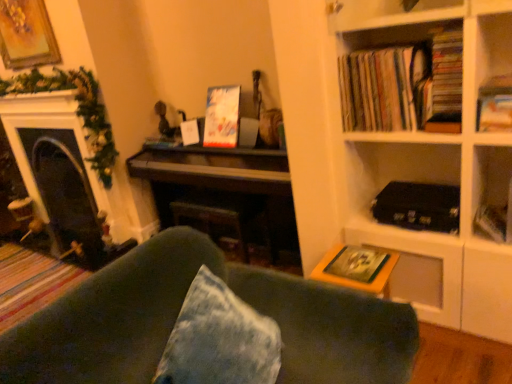
What is the approximate width of hardcover book at upper right, the 2th paperback book viewed from the top?

hardcover book at upper right, the 2th paperback book viewed from the top, is 11.61 centimeters in width.

This screenshot has width=512, height=384. Find the location of `matte paper at center, which is counted as the 3th paperback book, starting from the bottom`. matte paper at center, which is counted as the 3th paperback book, starting from the bottom is located at coordinates click(222, 117).

This screenshot has height=384, width=512. Find the location of `hardcover book at upper right, arranged as the 2th book when viewed from the left`. hardcover book at upper right, arranged as the 2th book when viewed from the left is located at coordinates (494, 113).

The image size is (512, 384). What do you see at coordinates (404, 85) in the screenshot? I see `matte cardboard books at upper right, which appears as the 1th book when viewed from the left` at bounding box center [404, 85].

The height and width of the screenshot is (384, 512). What do you see at coordinates (357, 264) in the screenshot? I see `yellow matte paperback book at lower right, positioned as the 3th paperback book in top-to-bottom order` at bounding box center [357, 264].

Where is `hardcover book at upper right, the 2th paperback book when ordered from bottom to top`? hardcover book at upper right, the 2th paperback book when ordered from bottom to top is located at coordinates (492, 222).

What's the angular difference between wooden bookcase at right and hardcover book at upper right, arranged as the 2th book when viewed from the left,'s facing directions?

They differ by 0.733 degrees in their facing directions.

Is wooden bookcase at right far from hardcover book at upper right, arranged as the 2th book when viewed from the left?

No, there isn't a large distance between wooden bookcase at right and hardcover book at upper right, arranged as the 2th book when viewed from the left.

Which is correct: wooden bookcase at right is inside hardcover book at upper right, arranged as the 2th book when viewed from the left, or outside of it?

wooden bookcase at right is not inside hardcover book at upper right, arranged as the 2th book when viewed from the left, it's outside.

Would you say dark wood piano at center is to the left or to the right of matte paper at center, which ranks as the third paperback book in right-to-left order, in the picture?

dark wood piano at center is positioned on matte paper at center, which ranks as the third paperback book in right-to-left order,'s left side.

Which is in front, point (182, 213) or point (238, 118)?

Point (238, 118)

How different are the orientations of dark wood piano at center and matte paper at center, acting as the 1th paperback book starting from the back, in degrees?

The facing directions of dark wood piano at center and matte paper at center, acting as the 1th paperback book starting from the back, are 0.35 degrees apart.

Is dark wood piano at center placed right next to matte paper at center, acting as the 1th paperback book starting from the back?

dark wood piano at center is not next to matte paper at center, acting as the 1th paperback book starting from the back, and they're not touching.

From the image's perspective, is matte paper at center, which ranks as the third paperback book in right-to-left order, beneath green fabric couch at lower center?

No, from the image's perspective, matte paper at center, which ranks as the third paperback book in right-to-left order, is not beneath green fabric couch at lower center.

From a real-world perspective, is matte paper at center, which is the 1th paperback book from top to bottom, physically above green fabric couch at lower center?

Answer: Yes, from a real-world perspective, matte paper at center, which is the 1th paperback book from top to bottom, is above green fabric couch at lower center.

How much distance is there between matte paper at center, which is counted as the 3th paperback book, starting from the bottom, and green fabric couch at lower center?

matte paper at center, which is counted as the 3th paperback book, starting from the bottom, and green fabric couch at lower center are 1.35 meters apart.

Are hardcover book at upper right, acting as the second paperback book starting from the back, and matte cardboard books at upper right, which appears as the 1th book when viewed from the left, far apart?

hardcover book at upper right, acting as the second paperback book starting from the back, is near matte cardboard books at upper right, which appears as the 1th book when viewed from the left, not far away.

Which is behind, hardcover book at upper right, which ranks as the third paperback book in left-to-right order, or matte cardboard books at upper right, which appears as the second book when viewed from the right?

hardcover book at upper right, which ranks as the third paperback book in left-to-right order.

From the image's perspective, is hardcover book at upper right, the 2th paperback book viewed from the top, beneath matte cardboard books at upper right, which appears as the 1th book when viewed from the left?

Result: Yes, from the image's perspective, hardcover book at upper right, the 2th paperback book viewed from the top, is below matte cardboard books at upper right, which appears as the 1th book when viewed from the left.

Is hardcover book at upper right, the 2th paperback book viewed from the top, wider than matte cardboard books at upper right, which appears as the 1th book when viewed from the left?

Incorrect, the width of hardcover book at upper right, the 2th paperback book viewed from the top, does not surpass that of matte cardboard books at upper right, which appears as the 1th book when viewed from the left.

Based on their sizes in the image, would you say hardcover book at upper right, arranged as the 2th book when viewed from the left, is bigger or smaller than green fabric couch at lower center?

Clearly, hardcover book at upper right, arranged as the 2th book when viewed from the left, is smaller in size than green fabric couch at lower center.

From a real-world perspective, is hardcover book at upper right, which appears as the first book when viewed from the right, located beneath green fabric couch at lower center?

Actually, hardcover book at upper right, which appears as the first book when viewed from the right, is physically above green fabric couch at lower center in the real world.

In the image, is hardcover book at upper right, arranged as the 2th book when viewed from the left, positioned in front of or behind green fabric couch at lower center?

Visually, hardcover book at upper right, arranged as the 2th book when viewed from the left, is located behind green fabric couch at lower center.

Considering the sizes of objects hardcover book at upper right, arranged as the 2th book when viewed from the left, and green fabric couch at lower center in the image provided, who is wider, hardcover book at upper right, arranged as the 2th book when viewed from the left, or green fabric couch at lower center?

Wider between the two is green fabric couch at lower center.

Would you say hardcover book at upper right, the 2th paperback book viewed from the top, is outside matte paper at center, acting as the 1th paperback book starting from the back?

Indeed, hardcover book at upper right, the 2th paperback book viewed from the top, is completely outside matte paper at center, acting as the 1th paperback book starting from the back.

From a real-world perspective, which is physically below, hardcover book at upper right, which is the 2th paperback book in front-to-back order, or matte paper at center, which ranks as the third paperback book in right-to-left order?

hardcover book at upper right, which is the 2th paperback book in front-to-back order, from a real-world perspective.

Image resolution: width=512 pixels, height=384 pixels. I want to click on paperback book lying behind the hardcover book at upper right, which is the 2th paperback book in front-to-back order, so click(222, 117).

Looking at their sizes, would you say hardcover book at upper right, the 2th paperback book viewed from the top, is wider or thinner than matte paper at center, which ranks as the third paperback book in right-to-left order?

Clearly, hardcover book at upper right, the 2th paperback book viewed from the top, has less width compared to matte paper at center, which ranks as the third paperback book in right-to-left order.

Would you say matte paper at center, which ranks as the third paperback book in right-to-left order, is inside or outside hardcover book at upper right, which is the 2th paperback book in front-to-back order?

matte paper at center, which ranks as the third paperback book in right-to-left order, is located beyond the bounds of hardcover book at upper right, which is the 2th paperback book in front-to-back order.

Does matte paper at center, which is counted as the 3th paperback book, starting from the bottom, have a greater width compared to hardcover book at upper right, which ranks as the third paperback book in left-to-right order?

Yes.

Can you confirm if matte paper at center, which is counted as the 3th paperback book, starting from the bottom, is positioned to the left of hardcover book at upper right, the 2th paperback book when ordered from bottom to top?

Correct, you'll find matte paper at center, which is counted as the 3th paperback book, starting from the bottom, to the left of hardcover book at upper right, the 2th paperback book when ordered from bottom to top.

Does matte paper at center, which ranks as the third paperback book in right-to-left order, have a lesser height compared to hardcover book at upper right, the 2th paperback book when ordered from bottom to top?

No, matte paper at center, which ranks as the third paperback book in right-to-left order, is not shorter than hardcover book at upper right, the 2th paperback book when ordered from bottom to top.

You are a GUI agent. You are given a task and a screenshot of the screen. Output one action in this format:
    pyautogui.click(x=<x>, y=<y>)
    Task: Click on the bookcase on the left of the hardcover book at upper right, arranged as the 2th book when viewed from the left
    
    Given the screenshot: What is the action you would take?
    pyautogui.click(x=438, y=159)

The image size is (512, 384). I want to click on piano in front of the matte paper at center, acting as the 1th paperback book starting from the back, so click(x=222, y=193).

Looking at this image, which object lies nearer to the anchor point hardcover book at upper right, which is counted as the 1th paperback book, starting from the right, dark wood piano at center or matte paper at center, the 1th paperback book viewed from the left?

Based on the image, dark wood piano at center appears to be nearer to hardcover book at upper right, which is counted as the 1th paperback book, starting from the right.

Considering their positions, is yellow matte paperback book at lower right, the 1th paperback book positioned from the bottom, positioned further to matte paper at center, which ranks as the third paperback book in right-to-left order, than green fabric couch at lower center?

green fabric couch at lower center lies further to matte paper at center, which ranks as the third paperback book in right-to-left order, than the other object.

Based on their spatial positions, is yellow matte paperback book at lower right, marked as the first paperback book in a front-to-back arrangement, or matte cardboard books at upper right, which appears as the 1th book when viewed from the left, further from hardcover book at upper right, the 2th paperback book when ordered from bottom to top?

Based on the image, matte cardboard books at upper right, which appears as the 1th book when viewed from the left, appears to be further to hardcover book at upper right, the 2th paperback book when ordered from bottom to top.

Based on their spatial positions, is wooden bookcase at right or matte cardboard books at upper right, which appears as the second book when viewed from the right, closer to hardcover book at upper right, which ranks as the third paperback book in left-to-right order?

wooden bookcase at right is positioned closer to the anchor hardcover book at upper right, which ranks as the third paperback book in left-to-right order.

Estimate the real-world distances between objects in this image. Which object is further from dark wood piano at center, hardcover book at upper right, which appears as the first book when viewed from the right, or wooden bookcase at right?

hardcover book at upper right, which appears as the first book when viewed from the right, lies further to dark wood piano at center than the other object.

Based on the photo, when comparing their distances from hardcover book at upper right, which is the 2th paperback book in front-to-back order, does matte paper at center, which appears as the third paperback book when viewed from the front, or dark wood piano at center seem closer?

dark wood piano at center is positioned closer to the anchor hardcover book at upper right, which is the 2th paperback book in front-to-back order.

Considering their positions, is matte paper at center, which is the 1th paperback book from top to bottom, positioned further to wooden bookcase at right than hardcover book at upper right, which appears as the first book when viewed from the right?

The object further to wooden bookcase at right is matte paper at center, which is the 1th paperback book from top to bottom.

From the image, which object appears to be farther from gold-framed painting at upper left, matte paper at center, the 1th paperback book viewed from the left, or hardcover book at upper right, acting as the second paperback book starting from the back?

Result: hardcover book at upper right, acting as the second paperback book starting from the back, is positioned further to the anchor gold-framed painting at upper left.

You are a GUI agent. You are given a task and a screenshot of the screen. Output one action in this format:
    pyautogui.click(x=<x>, y=<y>)
    Task: Click on the studio couch situated between gold-framed painting at upper left and hardcover book at upper right, arranged as the 2th book when viewed from the left, from left to right
    
    Given the screenshot: What is the action you would take?
    pyautogui.click(x=179, y=310)

Find the location of a particular element. studio couch situated between gold-framed painting at upper left and hardcover book at upper right, acting as the second paperback book starting from the back, from left to right is located at coordinates (179, 310).

Locate an element on the screen. The image size is (512, 384). piano between matte black fireplace at left and matte cardboard books at upper right, which appears as the 1th book when viewed from the left is located at coordinates (222, 193).

Find the location of a particular element. The height and width of the screenshot is (384, 512). book between gold-framed painting at upper left and wooden bookcase at right is located at coordinates (404, 85).